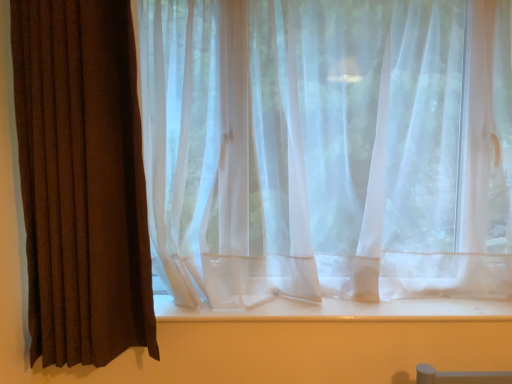
Question: Considering their positions, is brown textured curtain at left, placed as the 2th curtain when sorted from right to left, located in front of or behind white smooth window sill at center?

Choices:
 (A) behind
 (B) front

Answer: (B)

Question: Considering the positions of brown textured curtain at left, positioned as the 1th curtain in left-to-right order, and white smooth window sill at center in the image, is brown textured curtain at left, positioned as the 1th curtain in left-to-right order, wider or thinner than white smooth window sill at center?

Choices:
 (A) wide
 (B) thin

Answer: (B)

Question: Based on their relative distances, which object is nearer to the brown textured curtain at left, placed as the 2th curtain when sorted from right to left?

Choices:
 (A) translucent white curtain at center, which is the second curtain from left to right
 (B) white smooth window sill at center

Answer: (A)

Question: Estimate the real-world distances between objects in this image. Which object is closer to the brown textured curtain at left, positioned as the 1th curtain in left-to-right order?

Choices:
 (A) white smooth window sill at center
 (B) translucent white curtain at center, which is the second curtain from left to right

Answer: (B)